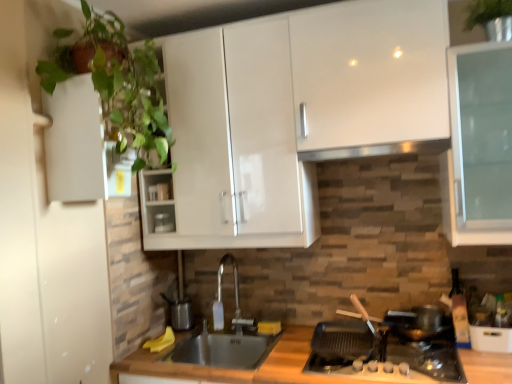
Question: Is black stainless steel sink at center bigger than stainless steel exhaust hood at upper center?

Choices:
 (A) yes
 (B) no

Answer: (A)

Question: From the image's perspective, is black stainless steel sink at center above stainless steel exhaust hood at upper center?

Choices:
 (A) no
 (B) yes

Answer: (A)

Question: Would you say stainless steel exhaust hood at upper center is part of black stainless steel sink at center's contents?

Choices:
 (A) no
 (B) yes

Answer: (A)

Question: Is black stainless steel sink at center thinner than stainless steel exhaust hood at upper center?

Choices:
 (A) yes
 (B) no

Answer: (B)

Question: Could you tell me if black stainless steel sink at center is facing stainless steel exhaust hood at upper center?

Choices:
 (A) yes
 (B) no

Answer: (B)

Question: Looking at the image, does matte white container at center seem bigger or smaller compared to black stainless steel sink at center?

Choices:
 (A) small
 (B) big

Answer: (A)

Question: From a real-world perspective, relative to black stainless steel sink at center, is matte white container at center vertically above or below?

Choices:
 (A) below
 (B) above

Answer: (B)

Question: Relative to black stainless steel sink at center, is matte white container at center in front or behind?

Choices:
 (A) front
 (B) behind

Answer: (B)

Question: Choose the correct answer: Is matte white container at center inside black stainless steel sink at center or outside it?

Choices:
 (A) inside
 (B) outside

Answer: (B)

Question: Is green leafy plant at left wider or thinner than black stainless steel sink at center?

Choices:
 (A) wide
 (B) thin

Answer: (B)

Question: From the image's perspective, is green leafy plant at left above or below black stainless steel sink at center?

Choices:
 (A) above
 (B) below

Answer: (A)

Question: From their relative heights in the image, would you say green leafy plant at left is taller or shorter than black stainless steel sink at center?

Choices:
 (A) tall
 (B) short

Answer: (A)

Question: Considering their positions, is green leafy plant at left located in front of or behind black stainless steel sink at center?

Choices:
 (A) behind
 (B) front

Answer: (B)

Question: Is black glass gas stove at lower right taller or shorter than black stainless steel sink at center?

Choices:
 (A) tall
 (B) short

Answer: (B)

Question: Considering the positions of black glass gas stove at lower right and black stainless steel sink at center in the image, is black glass gas stove at lower right wider or thinner than black stainless steel sink at center?

Choices:
 (A) wide
 (B) thin

Answer: (A)